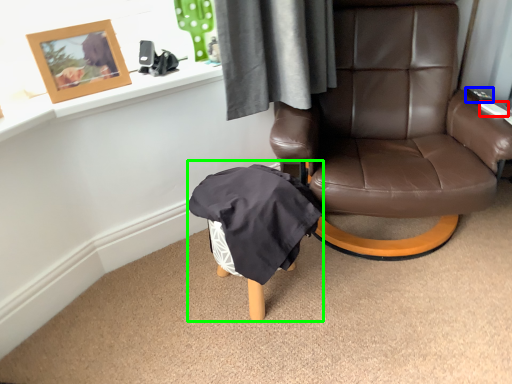
Question: Which object is the closest to the remote control (highlighted by a red box)? Choose among these: remote control (highlighted by a blue box) or bean bag chair (highlighted by a green box).

Choices:
 (A) remote control
 (B) bean bag chair

Answer: (A)